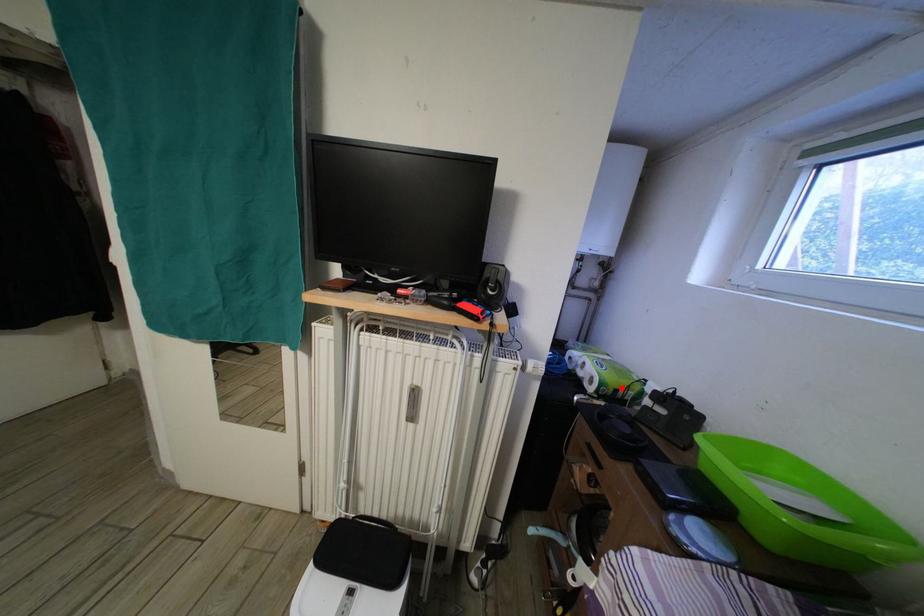
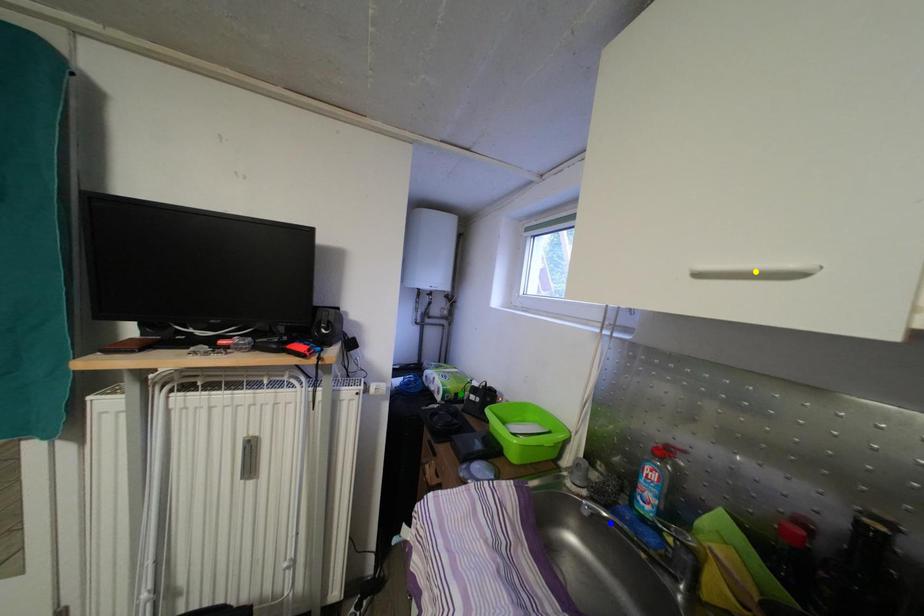
Question: I am providing you with two images of the same scene from different viewpoints. A red point is marked on the first image. You are given multiple points on the second image. In image 2, which mark is for the same physical point as the one in image 1?

Choices:
 (A) green point
 (B) blue point
 (C) yellow point

Answer: (A)